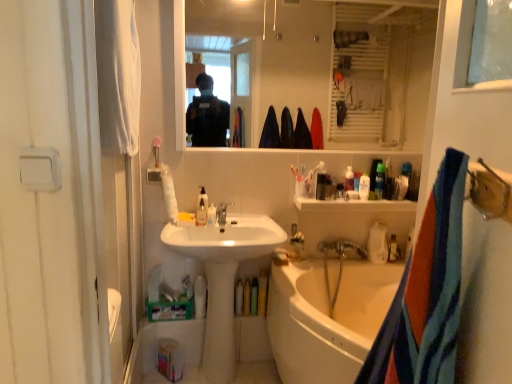
Identify the location of blank space situated above green cardboard box at lower center (from a real-world perspective). This screenshot has width=512, height=384. (169, 298).